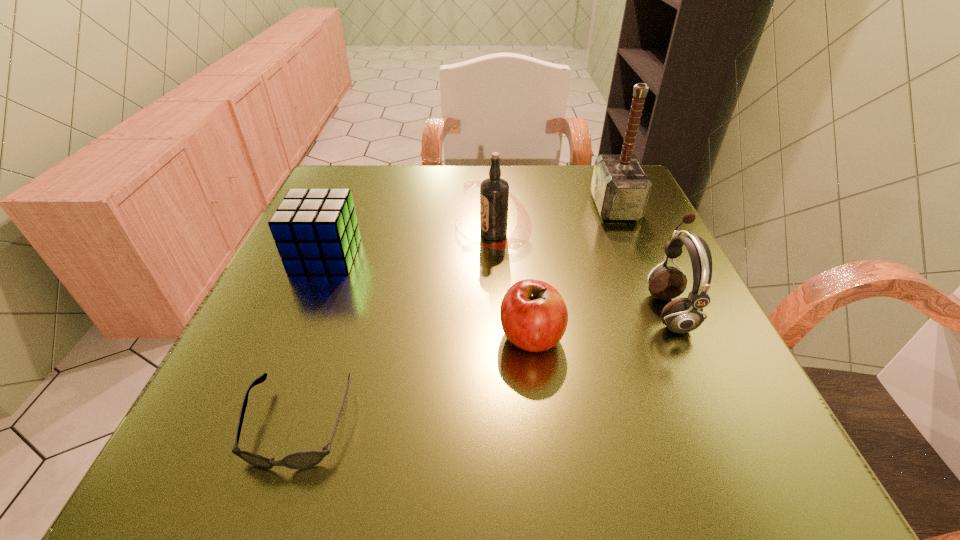
Where is `blank space located 0.140m on the label of the root beer`? The image size is (960, 540). blank space located 0.140m on the label of the root beer is located at coordinates (388, 234).

Identify the location of vacant region located on the ear pads of the earphone. (579, 310).

Where is `free spot located on the ear pads of the earphone`? free spot located on the ear pads of the earphone is located at coordinates (468, 310).

Locate an element on the screen. vacant space located 0.290m on the ear pads of the earphone is located at coordinates (479, 310).

The image size is (960, 540). Identify the location of vacant region located on the right of the cube. 472,256.

Identify the location of vacant position located 0.070m on the front of the apple. (539, 404).

Identify the location of hammer located at the far edge. (620, 187).

At what (x,y) coordinates should I click in order to perform the action: click on root beer that is at the far edge. Please return your answer as a coordinate pair (x, y). Looking at the image, I should click on point(494,191).

The height and width of the screenshot is (540, 960). I want to click on object located at the near edge, so click(x=306, y=459).

Where is `cube situated at the left edge`? The image size is (960, 540). cube situated at the left edge is located at coordinates (316, 231).